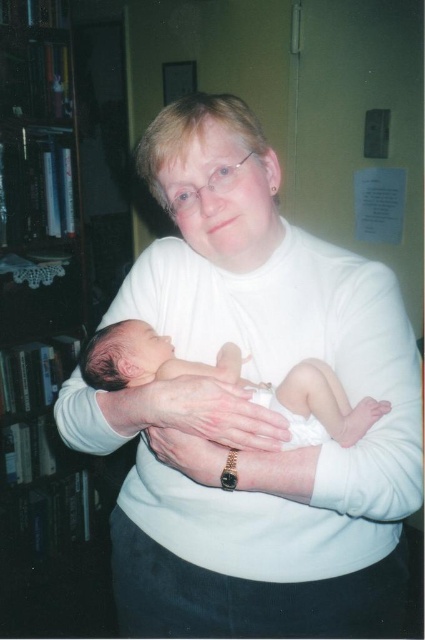
Question: Does white smooth sweater at center have a larger size compared to black wood bookshelf at left?

Choices:
 (A) no
 (B) yes

Answer: (A)

Question: Estimate the real-world distances between objects in this image. Which object is farther from the smooth white newborn at center?

Choices:
 (A) white smooth sweater at center
 (B) black wood bookshelf at left

Answer: (B)

Question: Which object is closer to the camera taking this photo?

Choices:
 (A) smooth white newborn at center
 (B) black wood bookshelf at left

Answer: (A)

Question: Is white smooth sweater at center thinner than smooth white newborn at center?

Choices:
 (A) no
 (B) yes

Answer: (A)

Question: Which point is farther to the camera?

Choices:
 (A) (8, 29)
 (B) (365, 467)

Answer: (A)

Question: Is black wood bookshelf at left wider than smooth white newborn at center?

Choices:
 (A) no
 (B) yes

Answer: (A)